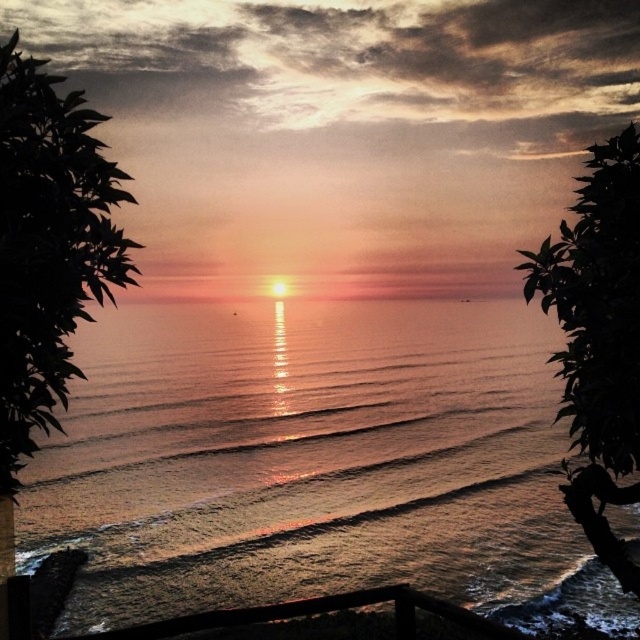
Is shiny metallic water at center to the left of silhouette leafy tree at right from the viewer's perspective?

Yes, shiny metallic water at center is to the left of silhouette leafy tree at right.

Is shiny metallic water at center bigger than silhouette leafy tree at right?

Correct, shiny metallic water at center is larger in size than silhouette leafy tree at right.

Where is `shiny metallic water at center`? The width and height of the screenshot is (640, 640). shiny metallic water at center is located at coordinates (310, 460).

Can you confirm if dark green leafy tree at left is bigger than silhouette leafy tree at right?

Yes, dark green leafy tree at left is bigger than silhouette leafy tree at right.

Between dark green leafy tree at left and silhouette leafy tree at right, which one is positioned higher?

dark green leafy tree at left is higher up.

What do you see at coordinates (49, 244) in the screenshot?
I see `dark green leafy tree at left` at bounding box center [49, 244].

Identify the location of dark green leafy tree at left. (49, 244).

Who is positioned more to the left, shiny metallic water at center or dark green leafy tree at left?

dark green leafy tree at left

Which of these two, shiny metallic water at center or dark green leafy tree at left, stands shorter?

With less height is shiny metallic water at center.

Does point (330, 355) come farther from viewer compared to point (116, 195)?

That is True.

Locate an element on the screen. shiny metallic water at center is located at coordinates (310, 460).